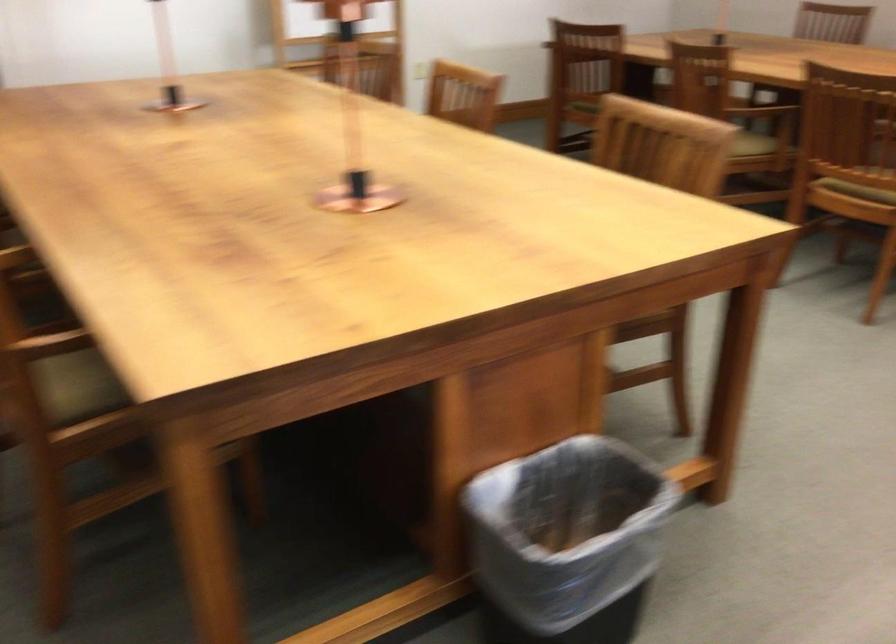
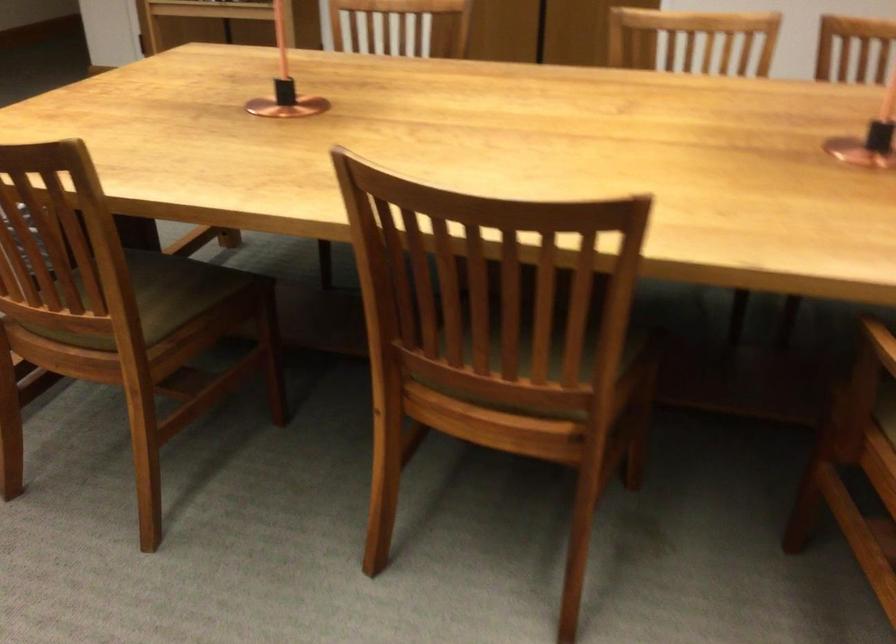
Where in the second image is the point corresponding to point 360,174 from the first image?

(285, 84)